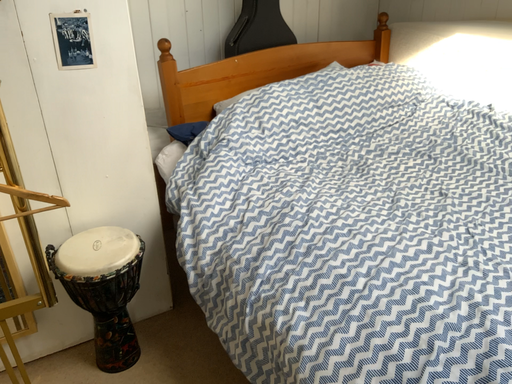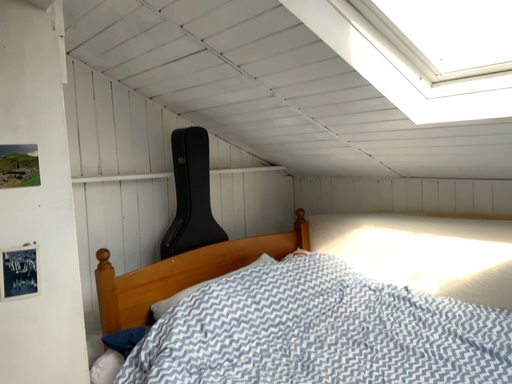
Question: Which way did the camera rotate in the video?

Choices:
 (A) rotated downward
 (B) rotated upward

Answer: (B)